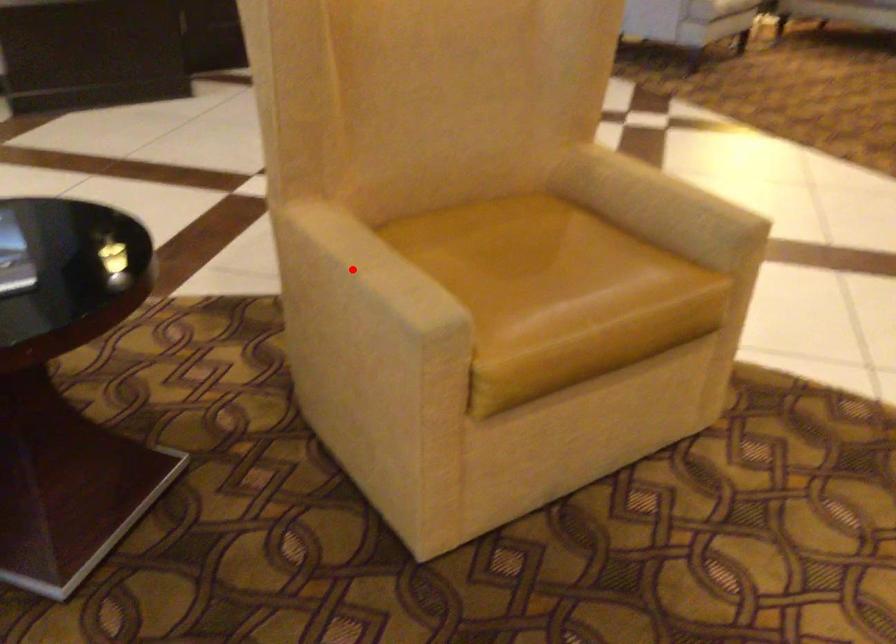
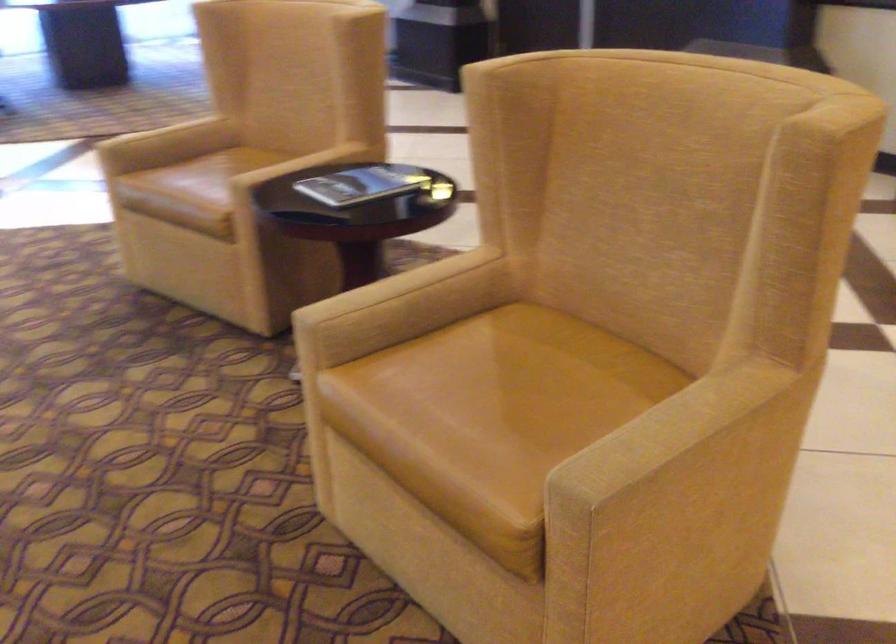
Find the pixel in the second image that matches the highlighted location in the first image.

(394, 286)